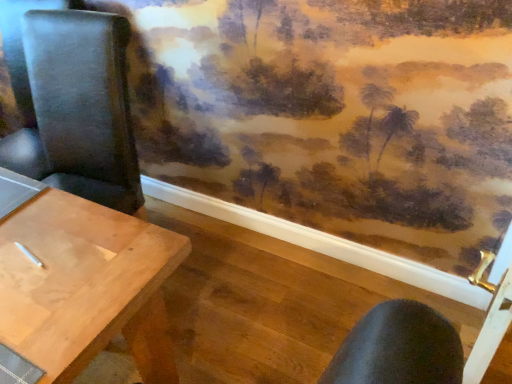
Question: Is black leather chair at left at the back of light brown wood table at left?

Choices:
 (A) no
 (B) yes

Answer: (B)

Question: Does light brown wood table at left have a larger size compared to black leather chair at left?

Choices:
 (A) no
 (B) yes

Answer: (B)

Question: Does light brown wood table at left have a greater height compared to black leather chair at left?

Choices:
 (A) yes
 (B) no

Answer: (B)

Question: Is light brown wood table at left shorter than black leather chair at left?

Choices:
 (A) no
 (B) yes

Answer: (B)

Question: Does light brown wood table at left appear on the right side of black leather chair at left?

Choices:
 (A) yes
 (B) no

Answer: (B)

Question: Does light brown wood table at left have a greater width compared to black leather chair at left?

Choices:
 (A) no
 (B) yes

Answer: (A)

Question: Could you tell me if black leather chair at left is turned towards light brown wood table at left?

Choices:
 (A) yes
 (B) no

Answer: (A)

Question: Is black leather chair at left bigger than light brown wood table at left?

Choices:
 (A) yes
 (B) no

Answer: (B)

Question: Is black leather chair at left thinner than light brown wood table at left?

Choices:
 (A) yes
 (B) no

Answer: (B)

Question: From a real-world perspective, is black leather chair at left physically below light brown wood table at left?

Choices:
 (A) no
 (B) yes

Answer: (A)

Question: Is black leather chair at left taller than light brown wood table at left?

Choices:
 (A) no
 (B) yes

Answer: (B)

Question: Is black leather chair at left at the left side of light brown wood table at left?

Choices:
 (A) no
 (B) yes

Answer: (A)

Question: Is light brown wood table at left wider or thinner than black leather chair at left?

Choices:
 (A) wide
 (B) thin

Answer: (B)